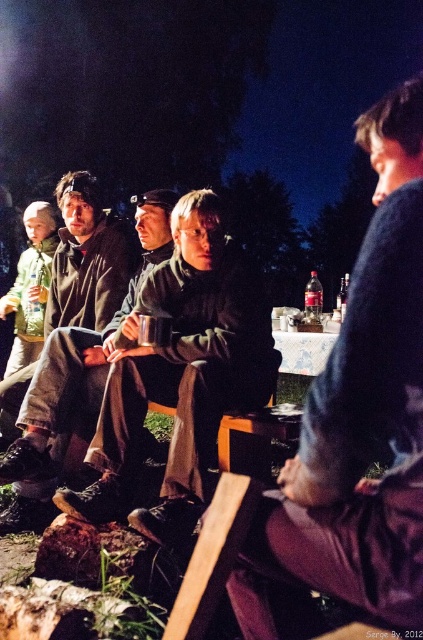
You are organizing a coat rack for the group and want to place the dark blue sweater at upper right and the dark brown leather jacket at center. Which item requires more space on the rack?

The dark brown leather jacket at center requires more space on the rack because it is larger than the dark blue sweater at upper right.

You are a photographer trying to capture a photo of the dark blue sweater at upper right and the dark green fabric jacket at center. Which clothing item is placed higher in the image?

The dark blue sweater at upper right is positioned over the dark green fabric jacket at center, so it is placed higher in the image.